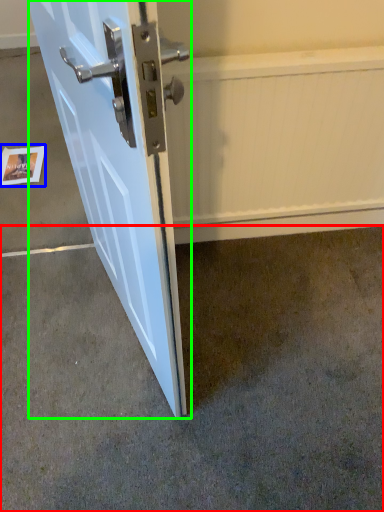
Question: Which object is the farthest from concrete (highlighted by a red box)? Choose among these: postcard (highlighted by a blue box) or door (highlighted by a green box).

Choices:
 (A) postcard
 (B) door

Answer: (A)